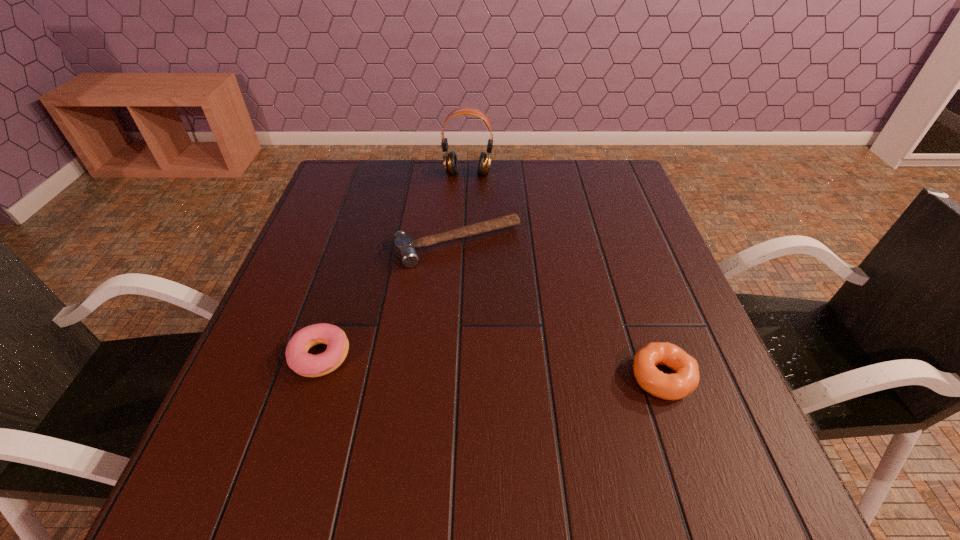
Image resolution: width=960 pixels, height=540 pixels. Identify the location of vacant area at the near edge. (590, 424).

The width and height of the screenshot is (960, 540). I want to click on vacant space at the left edge, so click(292, 320).

In order to click on free space at the right edge of the desktop in this screenshot , I will do `click(652, 291)`.

Identify the location of vacant space at the far left corner of the desktop. Image resolution: width=960 pixels, height=540 pixels. (336, 164).

This screenshot has width=960, height=540. I want to click on vacant area that lies between the shortest object and the farthest object, so click(x=463, y=209).

What are the coordinates of `vacant area that lies between the right doughnut and the leftmost object` in the screenshot? It's located at (491, 367).

Locate an element on the screen. This screenshot has height=540, width=960. vacant area that lies between the right doughnut and the shortest object is located at coordinates (561, 310).

The image size is (960, 540). I want to click on empty space between the shortest object and the rightmost object, so click(x=561, y=310).

Identify the location of free spot between the headset and the left doughnut. [x=394, y=265].

What are the coordinates of `vacant space that is in between the farthest object and the left doughnut` in the screenshot? It's located at (394, 265).